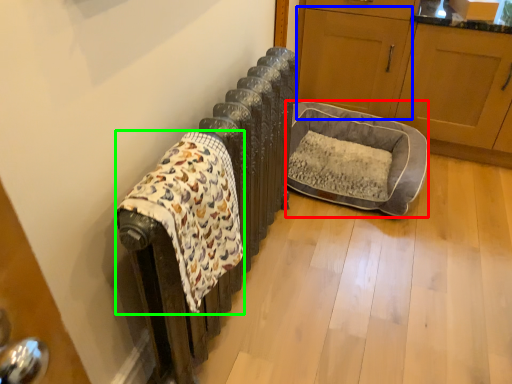
Question: Which object is the farthest from dog bed (highlighted by a red box)? Choose among these: screen door (highlighted by a blue box) or blanket (highlighted by a green box).

Choices:
 (A) screen door
 (B) blanket

Answer: (B)